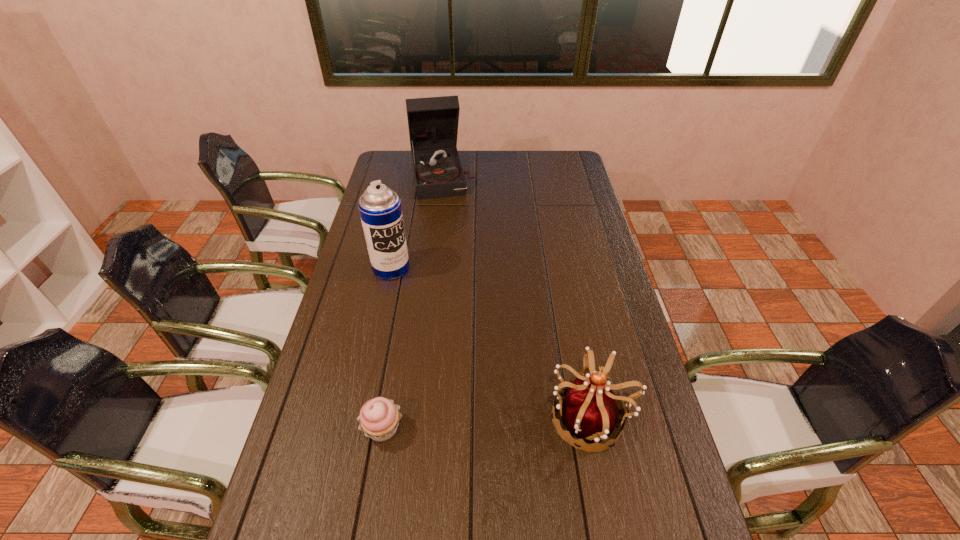
Where is `object positioned at the far left corner`? The image size is (960, 540). object positioned at the far left corner is located at coordinates (433, 122).

The image size is (960, 540). Identify the location of vacant position at the far edge of the desktop. (495, 165).

Where is `vacant space at the left edge`? The height and width of the screenshot is (540, 960). vacant space at the left edge is located at coordinates (382, 293).

At what (x,y) coordinates should I click in order to perform the action: click on free spot at the right edge of the desktop. Please return your answer as a coordinate pair (x, y). Looking at the image, I should click on (644, 383).

Identify the location of free space at the far right corner of the desktop. This screenshot has width=960, height=540. (569, 154).

Where is `vacant area at the near right corner of the desktop`? vacant area at the near right corner of the desktop is located at coordinates (689, 507).

This screenshot has width=960, height=540. In order to click on free spot between the cupcake and the phonograph_record in this screenshot , I will do `click(413, 302)`.

This screenshot has width=960, height=540. Identify the location of free space between the cupcake and the third tallest object. (487, 423).

In order to click on empty location between the aerosol can and the farthest object in this screenshot , I will do `click(417, 222)`.

Locate an element on the screen. free space between the cupcake and the second farthest object is located at coordinates (387, 348).